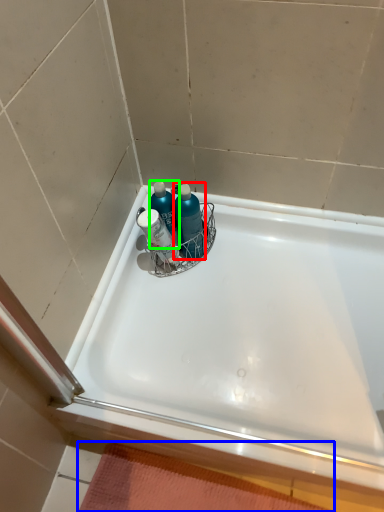
Question: Which object is the closest to the cleaning product (highlighted by a red box)? Choose among these: bath mat (highlighted by a blue box) or cleaning product (highlighted by a green box).

Choices:
 (A) bath mat
 (B) cleaning product

Answer: (B)